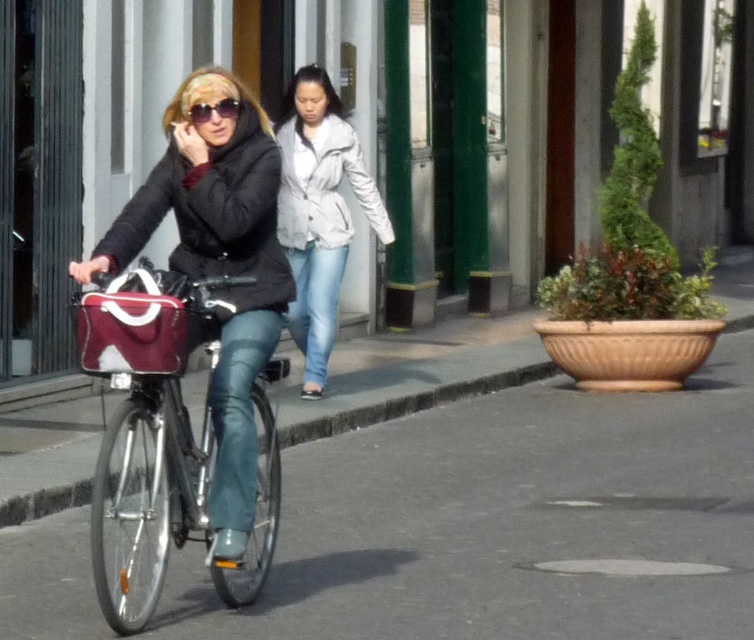
Question: Which point is closer to the camera?

Choices:
 (A) light gray textured jacket at center
 (B) matte black sunglasses at upper center
 (C) maroon fabric bag at left

Answer: (C)

Question: Does maroon fabric bag at left have a lesser width compared to matte black sunglasses at upper center?

Choices:
 (A) yes
 (B) no

Answer: (B)

Question: Which of the following is the farthest from the observer?

Choices:
 (A) shiny metallic bicycle at left
 (B) maroon fabric bag at left
 (C) light gray textured jacket at center

Answer: (C)

Question: Is shiny metallic bicycle at left positioned at the back of maroon fabric bag at left?

Choices:
 (A) yes
 (B) no

Answer: (A)

Question: Which point appears farthest from the camera in this image?

Choices:
 (A) (130, 316)
 (B) (130, 435)
 (C) (316, 196)

Answer: (C)

Question: Considering the relative positions of light gray textured jacket at center and matte black sunglasses at upper center in the image provided, where is light gray textured jacket at center located with respect to matte black sunglasses at upper center?

Choices:
 (A) right
 (B) left

Answer: (A)